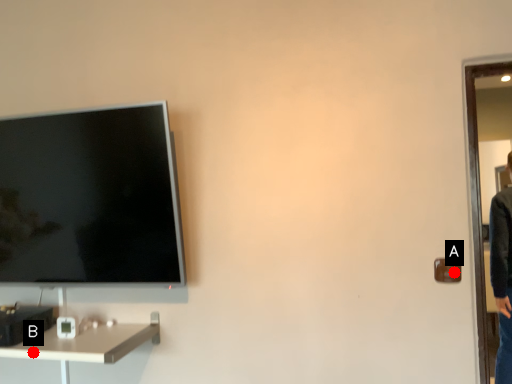
Question: Two points are circled on the image, labeled by A and B beside each circle. Which point is closer to the camera?

Choices:
 (A) A is closer
 (B) B is closer

Answer: (A)